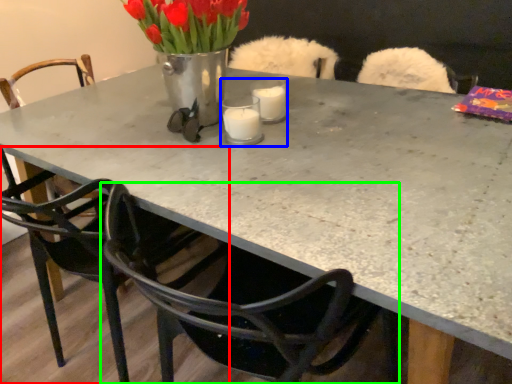
Question: Estimate the real-world distances between objects in this image. Which object is closer to chair (highlighted by a red box), candle holder (highlighted by a blue box) or chair (highlighted by a green box)?

Choices:
 (A) candle holder
 (B) chair

Answer: (B)